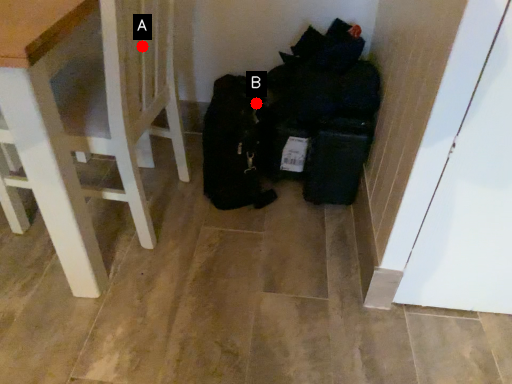
Question: Two points are circled on the image, labeled by A and B beside each circle. Which point is farther from the camera taking this photo?

Choices:
 (A) A is further
 (B) B is further

Answer: (B)